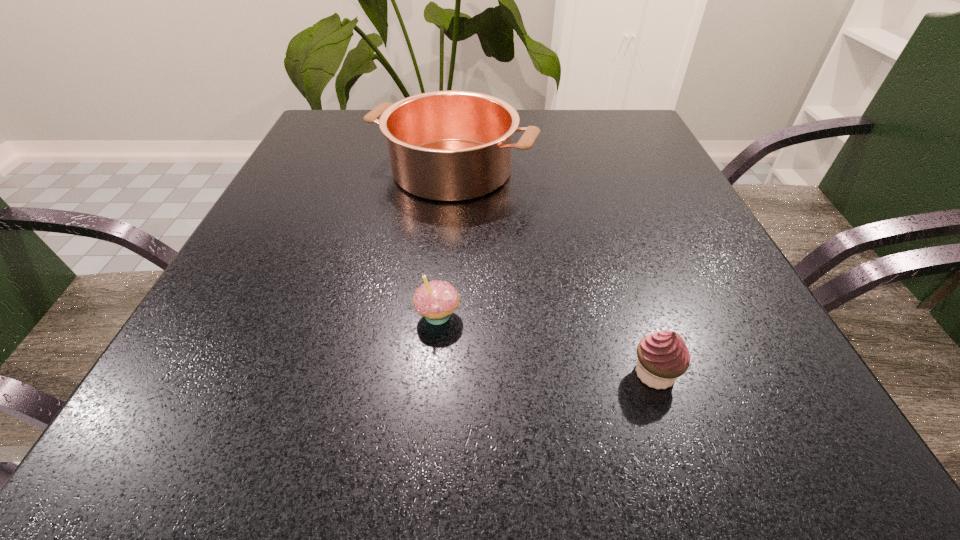
This screenshot has height=540, width=960. I want to click on empty location between the right cupcake and the farthest object, so click(553, 272).

Locate an element on the screen. blank region between the rightmost object and the tallest object is located at coordinates (553, 272).

The image size is (960, 540). I want to click on vacant region between the left cupcake and the tallest object, so click(x=444, y=242).

The width and height of the screenshot is (960, 540). Identify the location of vacant area that lies between the rightmost object and the saucepan. (553, 272).

Where is `blank region between the nearer cupcake and the farther cupcake`? The image size is (960, 540). blank region between the nearer cupcake and the farther cupcake is located at coordinates (546, 344).

At what (x,y) coordinates should I click in order to perform the action: click on vacant area that lies between the second nearest object and the rightmost object. Please return your answer as a coordinate pair (x, y). The image size is (960, 540). Looking at the image, I should click on (546, 344).

This screenshot has width=960, height=540. I want to click on blank region between the nearer cupcake and the farther cupcake, so click(546, 344).

Locate an element on the screen. free space between the farthest object and the farther cupcake is located at coordinates (444, 242).

Find the location of a particular element. Image resolution: width=960 pixels, height=540 pixels. object that is the second closest to the second farthest object is located at coordinates (450, 146).

Identify which object is located as the nearest to the right cupcake. Please provide its 2D coordinates. Your answer should be formatted as a tuple, i.e. [(x, y)], where the tuple contains the x and y coordinates of a point satisfying the conditions above.

[(436, 300)]